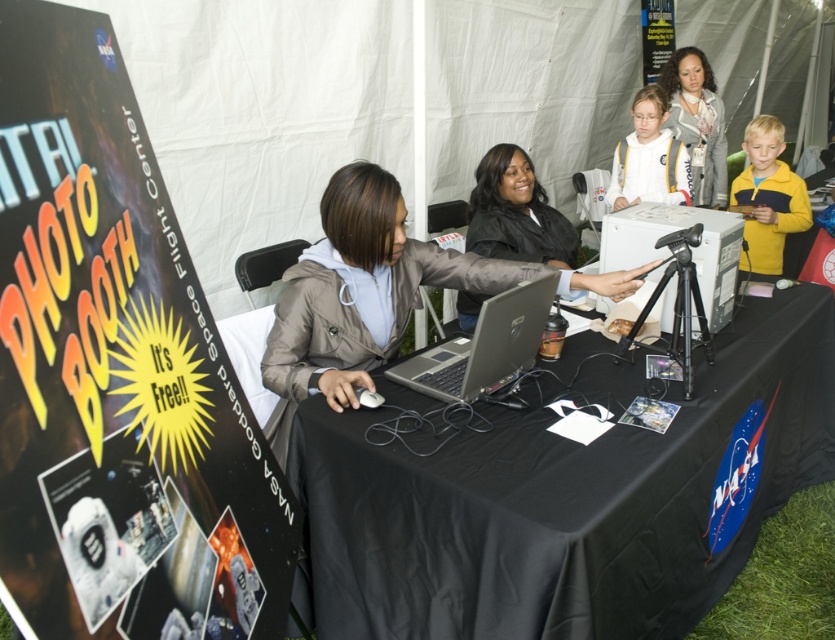
Does white fabric vest at upper center have a larger size compared to matte gray hoodie at upper center?

No.

Where is `white fabric vest at upper center`? white fabric vest at upper center is located at coordinates (646, 157).

What do you see at coordinates (646, 157) in the screenshot?
I see `white fabric vest at upper center` at bounding box center [646, 157].

Identify the location of white fabric vest at upper center. (646, 157).

Who is more forward, (x=643, y=376) or (x=539, y=285)?

Point (x=539, y=285)

Does point (633, 538) come closer to viewer compared to point (481, 355)?

Yes.

The width and height of the screenshot is (835, 640). What do you see at coordinates (559, 496) in the screenshot?
I see `black fabric table at center` at bounding box center [559, 496].

In order to click on black fabric table at center in this screenshot , I will do `click(559, 496)`.

Between point (783, 170) and point (682, 67), which one is positioned behind?

The point (682, 67) is behind.

Is yellow fleece jacket at right thinner than matte gray hoodie at upper center?

Incorrect, yellow fleece jacket at right's width is not less than matte gray hoodie at upper center's.

This screenshot has height=640, width=835. Describe the element at coordinates (768, 196) in the screenshot. I see `yellow fleece jacket at right` at that location.

Where is `yellow fleece jacket at right`? This screenshot has width=835, height=640. yellow fleece jacket at right is located at coordinates (768, 196).